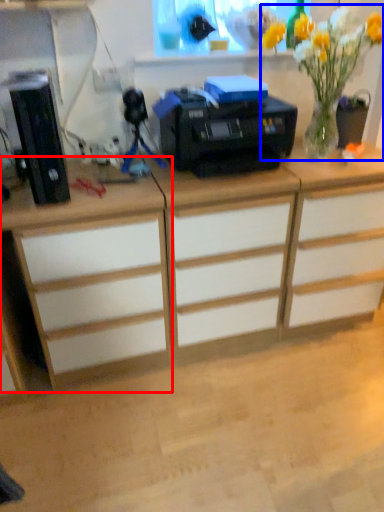
Question: Which object is closer to the camera taking this photo, desk (highlighted by a red box) or floral arrangement (highlighted by a blue box)?

Choices:
 (A) desk
 (B) floral arrangement

Answer: (A)